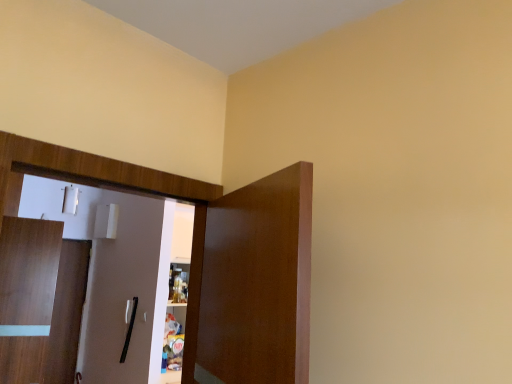
I want to click on brown wooden door at center, the 1th door viewed from the top, so click(252, 284).

What are the coordinates of `brown wooden door at center, positioned as the 2th door in bottom-to-top order` in the screenshot? It's located at (252, 284).

Is point (57, 276) positioned after point (252, 284)?

Yes, it is.

From a real-world perspective, between wooden door at left, the 2th door in the top-to-bottom sequence, and brown wooden door at center, the 1th door viewed from the top, who is vertically higher?

brown wooden door at center, the 1th door viewed from the top, is physically above.

Is wooden door at left, the 2th door in the top-to-bottom sequence, not close to brown wooden door at center, positioned as the 2th door in bottom-to-top order?

Yes, wooden door at left, the 2th door in the top-to-bottom sequence, and brown wooden door at center, positioned as the 2th door in bottom-to-top order, are located far from each other.

Is brown wooden door at center, acting as the 2th door starting from the left, completely or partially inside wooden door at left, which is the second door in right-to-left order?

Definitely not — brown wooden door at center, acting as the 2th door starting from the left, is not inside wooden door at left, which is the second door in right-to-left order.

Considering the relative positions of wooden dresser at left and wooden door at left, acting as the 1th door starting from the back, in the image provided, is wooden dresser at left behind wooden door at left, acting as the 1th door starting from the back,?

No, it is in front of wooden door at left, acting as the 1th door starting from the back.

Would you say wooden dresser at left is outside wooden door at left, the 2th door when ordered from front to back?

Absolutely, wooden dresser at left is external to wooden door at left, the 2th door when ordered from front to back.

From the image's perspective, is wooden dresser at left located above or below wooden door at left, which is the second door in right-to-left order?

wooden dresser at left is situated higher than wooden door at left, which is the second door in right-to-left order, in the image.

The image size is (512, 384). I want to click on dresser that is in front of the wooden door at left, the 2th door in the top-to-bottom sequence, so click(214, 257).

Is wooden door at left, which is the second door in right-to-left order, shorter than wooden dresser at left?

No.

Can we say wooden door at left, the 2th door in the top-to-bottom sequence, lies outside wooden dresser at left?

wooden door at left, the 2th door in the top-to-bottom sequence, is positioned outside wooden dresser at left.

Between wooden door at left, acting as the first door starting from the bottom, and wooden dresser at left, which one has smaller width?

Thinner between the two is wooden door at left, acting as the first door starting from the bottom.

Which is more distant, [78,301] or [298,213]?

Point [78,301]

Is wooden dresser at left shorter than brown wooden door at center, which is counted as the second door, starting from the back?

No, wooden dresser at left is not shorter than brown wooden door at center, which is counted as the second door, starting from the back.

Measure the distance between wooden dresser at left and brown wooden door at center, which is counted as the second door, starting from the back.

The distance of wooden dresser at left from brown wooden door at center, which is counted as the second door, starting from the back, is 2.55 inches.

Based on the photo, how many degrees apart are the facing directions of wooden dresser at left and brown wooden door at center, which is counted as the second door, starting from the back?

The angle between the facing direction of wooden dresser at left and the facing direction of brown wooden door at center, which is counted as the second door, starting from the back, is 112 degrees.

Can you confirm if wooden dresser at left is positioned to the left of brown wooden door at center, the first door positioned from the front?

Correct, you'll find wooden dresser at left to the left of brown wooden door at center, the first door positioned from the front.

From the image's perspective, would you say brown wooden door at center, positioned as the 2th door in bottom-to-top order, is shown under wooden door at left, the 2th door when ordered from front to back?

No, from the image's perspective, brown wooden door at center, positioned as the 2th door in bottom-to-top order, is not below wooden door at left, the 2th door when ordered from front to back.

Which object is positioned more to the left, brown wooden door at center, the first door viewed from the right, or wooden door at left, the 2th door when ordered from front to back?

Positioned to the left is wooden door at left, the 2th door when ordered from front to back.

Is brown wooden door at center, the first door positioned from the front, bigger than wooden door at left, acting as the first door starting from the bottom?

Correct, brown wooden door at center, the first door positioned from the front, is larger in size than wooden door at left, acting as the first door starting from the bottom.

Is brown wooden door at center, which is counted as the second door, starting from the back, oriented towards wooden door at left, the 2th door when ordered from front to back?

No, brown wooden door at center, which is counted as the second door, starting from the back, does not turn towards wooden door at left, the 2th door when ordered from front to back.

Consider the image. Looking at the image, does brown wooden door at center, the 1th door viewed from the top, seem bigger or smaller compared to wooden dresser at left?

Clearly, brown wooden door at center, the 1th door viewed from the top, is larger in size than wooden dresser at left.

Which object is closer to the camera, brown wooden door at center, acting as the 2th door starting from the left, or wooden dresser at left?

brown wooden door at center, acting as the 2th door starting from the left.

Where is `dresser behind the brown wooden door at center, acting as the 2th door starting from the left`? dresser behind the brown wooden door at center, acting as the 2th door starting from the left is located at coordinates (214, 257).

Could you tell me if brown wooden door at center, which is counted as the second door, starting from the back, is facing wooden dresser at left?

Yes, brown wooden door at center, which is counted as the second door, starting from the back, is oriented towards wooden dresser at left.

Find the location of a particular element. door in front of the wooden door at left, acting as the first door starting from the bottom is located at coordinates (252, 284).

At what (x,y) coordinates should I click in order to perform the action: click on dresser that is above the wooden door at left, acting as the 1th door starting from the back (from a real-world perspective). Please return your answer as a coordinate pair (x, y). Looking at the image, I should click on (x=214, y=257).

From the image, which object appears to be farther from wooden dresser at left, wooden door at left, the 2th door in the top-to-bottom sequence, or brown wooden door at center, which is counted as the second door, starting from the back?

wooden door at left, the 2th door in the top-to-bottom sequence.

Which object lies nearer to the anchor point brown wooden door at center, positioned as the 2th door in bottom-to-top order, wooden dresser at left or wooden door at left, which ranks as the 1th door in left-to-right order?

wooden dresser at left.

Looking at the image, which one is located closer to brown wooden door at center, the first door viewed from the right, wooden door at left, acting as the first door starting from the bottom, or wooden dresser at left?

wooden dresser at left.

In the scene shown: When comparing their distances from wooden door at left, the 2th door when ordered from front to back, does wooden dresser at left or brown wooden door at center, which is counted as the second door, starting from the back, seem closer?

Among the two, wooden dresser at left is located nearer to wooden door at left, the 2th door when ordered from front to back.

Based on their spatial positions, is brown wooden door at center, which is counted as the second door, starting from the back, or wooden dresser at left closer to wooden door at left, which is the second door in right-to-left order?

The object closer to wooden door at left, which is the second door in right-to-left order, is wooden dresser at left.

From the image, which object appears to be nearer to wooden dresser at left, brown wooden door at center, which is counted as the second door, starting from the back, or wooden door at left, acting as the first door starting from the bottom?

brown wooden door at center, which is counted as the second door, starting from the back, is positioned closer to the anchor wooden dresser at left.

Where is `dresser between brown wooden door at center, the first door positioned from the front, and wooden door at left, the 2th door when ordered from front to back, from front to back`? The height and width of the screenshot is (384, 512). dresser between brown wooden door at center, the first door positioned from the front, and wooden door at left, the 2th door when ordered from front to back, from front to back is located at coordinates (214, 257).